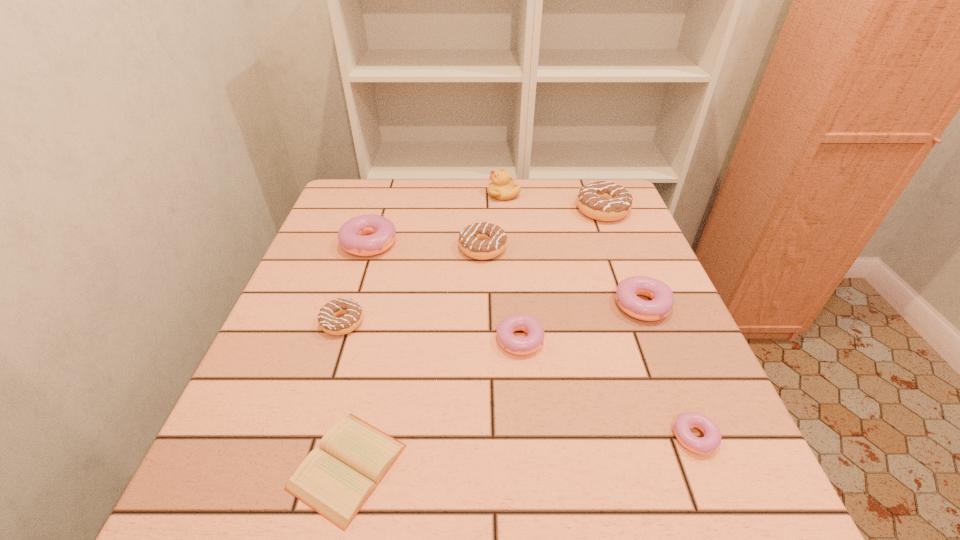
This screenshot has width=960, height=540. I want to click on blank area in the image that satisfies the following two spatial constraints: 1. on the front-facing side of the second shortest object; 2. on the right side of the yellow duckling, so click(522, 437).

Identify the location of free spot that satisfies the following two spatial constraints: 1. on the back side of the second smallest purple doughnut; 2. on the right side of the second biggest purple doughnut. (518, 310).